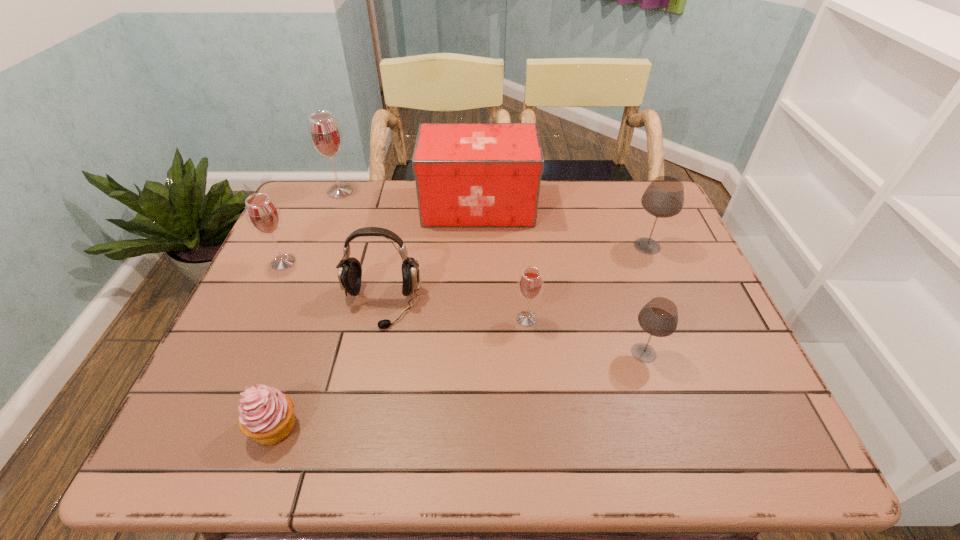
Locate an element on the screen. The image size is (960, 540). the farthest red wineglass is located at coordinates (325, 135).

The image size is (960, 540). I want to click on the biggest red wineglass, so click(x=325, y=135).

The height and width of the screenshot is (540, 960). Identify the location of the first-aid kit. (467, 174).

Where is `the second farthest red wineglass`? This screenshot has height=540, width=960. the second farthest red wineglass is located at coordinates (263, 215).

You are a GUI agent. You are given a task and a screenshot of the screen. Output one action in this format:
    pyautogui.click(x=<x>, y=<y>)
    Task: Click on the rightmost object
    The height and width of the screenshot is (540, 960).
    Given the screenshot: What is the action you would take?
    pyautogui.click(x=664, y=197)

This screenshot has height=540, width=960. I want to click on the right gray wineglass, so click(664, 197).

The height and width of the screenshot is (540, 960). I want to click on headset, so click(x=349, y=272).

The width and height of the screenshot is (960, 540). Find the location of `the nearer gray wineglass`. the nearer gray wineglass is located at coordinates (659, 317).

Locate an element on the screen. the fourth wineglass from left to right is located at coordinates (659, 317).

Find the location of a particular element. The width and height of the screenshot is (960, 540). the nearest red wineglass is located at coordinates (530, 284).